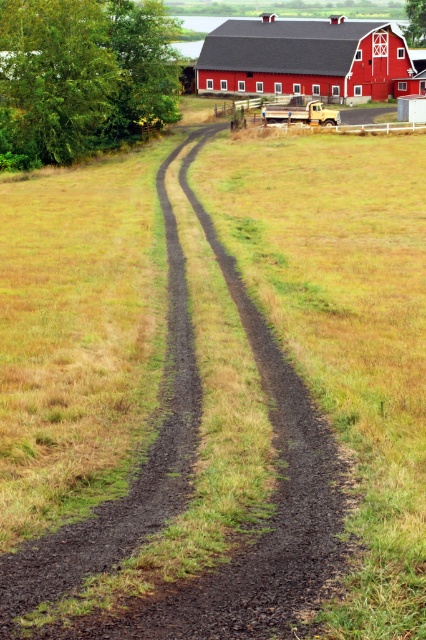
You are driving a tractor that is 15 feet long and want to park it between the dark brown gravel at center and the red wooden barn at upper center. Is there enough space between them for the tractor?

The distance between the dark brown gravel at center and the red wooden barn at upper center is 315.04 feet, which is significantly longer than the tractor length of 15 feet. Therefore, there is ample space to park the tractor between them.

You are driving a car that is 4 meters long. You see the dark brown gravel at center and the red wooden barn at upper center. Can your car fit between them without touching either?

The dark brown gravel at center is smaller than the red wooden barn at upper center, but the exact distance between them isn